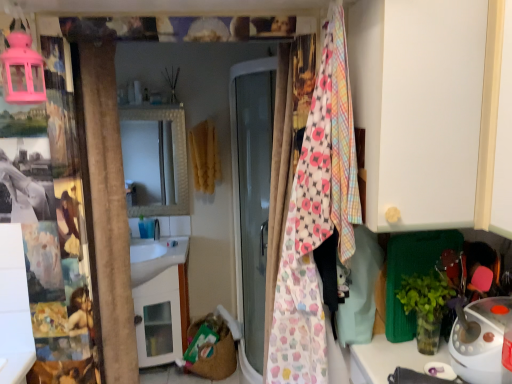
Question: From a real-world perspective, relative to white plastic iron at lower right, is cupcake-patterned fabric at center vertically above or below?

Choices:
 (A) below
 (B) above

Answer: (B)

Question: In terms of width, does cupcake-patterned fabric at center look wider or thinner when compared to white plastic iron at lower right?

Choices:
 (A) wide
 (B) thin

Answer: (A)

Question: Considering their positions, is cupcake-patterned fabric at center located in front of or behind white plastic iron at lower right?

Choices:
 (A) behind
 (B) front

Answer: (B)

Question: Looking at their shapes, would you say white plastic iron at lower right is wider or thinner than cupcake-patterned fabric at center?

Choices:
 (A) wide
 (B) thin

Answer: (B)

Question: Based on their positions, is white plastic iron at lower right located to the left or right of cupcake-patterned fabric at center?

Choices:
 (A) left
 (B) right

Answer: (B)

Question: In terms of height, does white plastic iron at lower right look taller or shorter compared to cupcake-patterned fabric at center?

Choices:
 (A) short
 (B) tall

Answer: (A)

Question: Is white plastic iron at lower right bigger or smaller than cupcake-patterned fabric at center?

Choices:
 (A) big
 (B) small

Answer: (B)